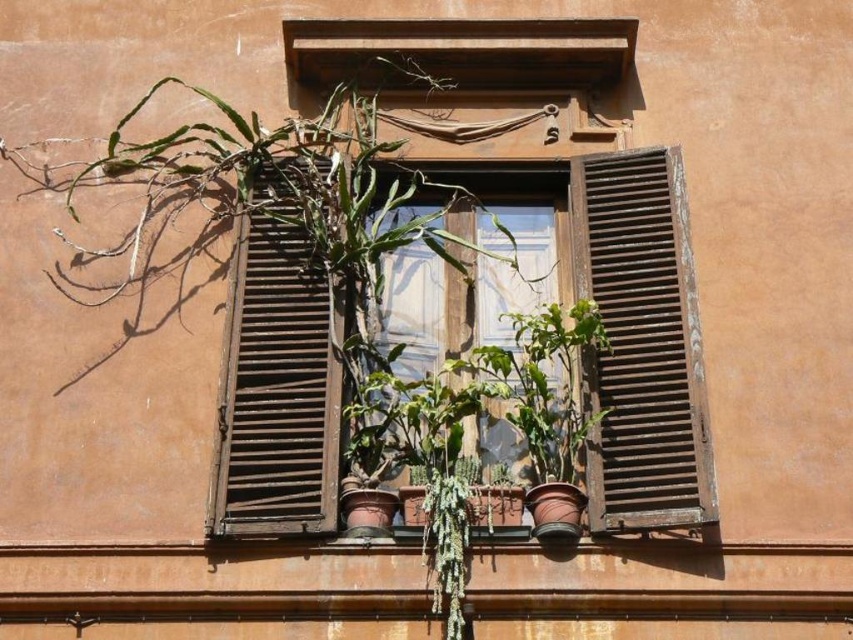
Can you confirm if green matte plant at left is positioned to the right of wooden at right?

No, green matte plant at left is not to the right of wooden at right.

Which is behind, point (276, 208) or point (590, 465)?

Positioned behind is point (276, 208).

Find the location of a particular element. This screenshot has height=640, width=853. green matte plant at left is located at coordinates (274, 276).

Who is positioned more to the left, wooden at right or wooden at center?

From the viewer's perspective, wooden at center appears more on the left side.

Where is `wooden at right`? This screenshot has width=853, height=640. wooden at right is located at coordinates (641, 342).

Does point (602, 508) come closer to viewer compared to point (292, 356)?

Yes, point (602, 508) is in front of point (292, 356).

Image resolution: width=853 pixels, height=640 pixels. I want to click on wooden at right, so click(641, 342).

Is green matte plant at left bigger than wooden at center?

Yes.

Is green matte plant at left to the left of wooden at center from the viewer's perspective?

No, green matte plant at left is not to the left of wooden at center.

Which is behind, point (166, 180) or point (331, 364)?

The point (166, 180) is behind.

Identify the location of green matte plant at left. (274, 276).